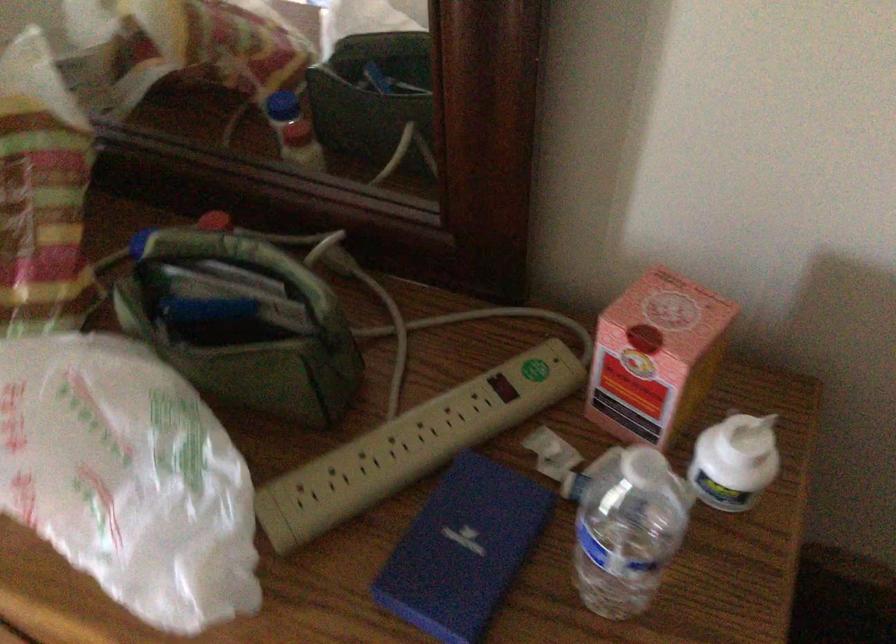
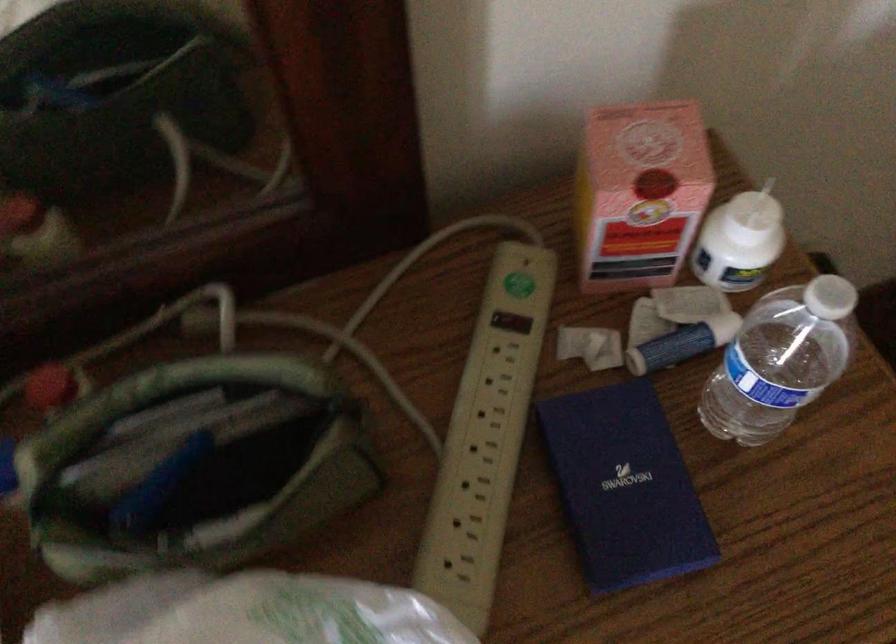
The first image is from the beginning of the video and the second image is from the end. How did the camera likely rotate when shooting the video?

The camera rotated toward right-down.